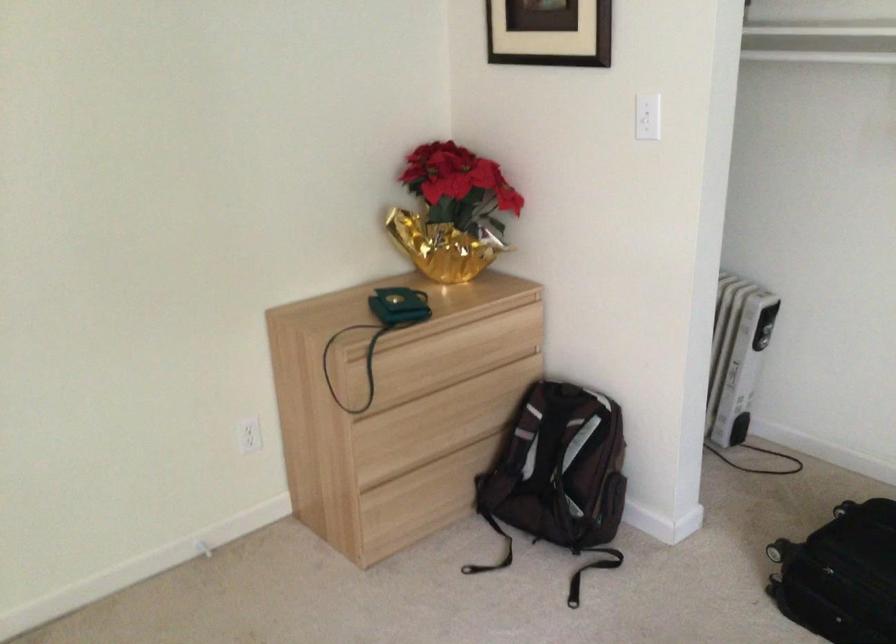
Locate an element on the screen. The image size is (896, 644). white light switch is located at coordinates (647, 116).